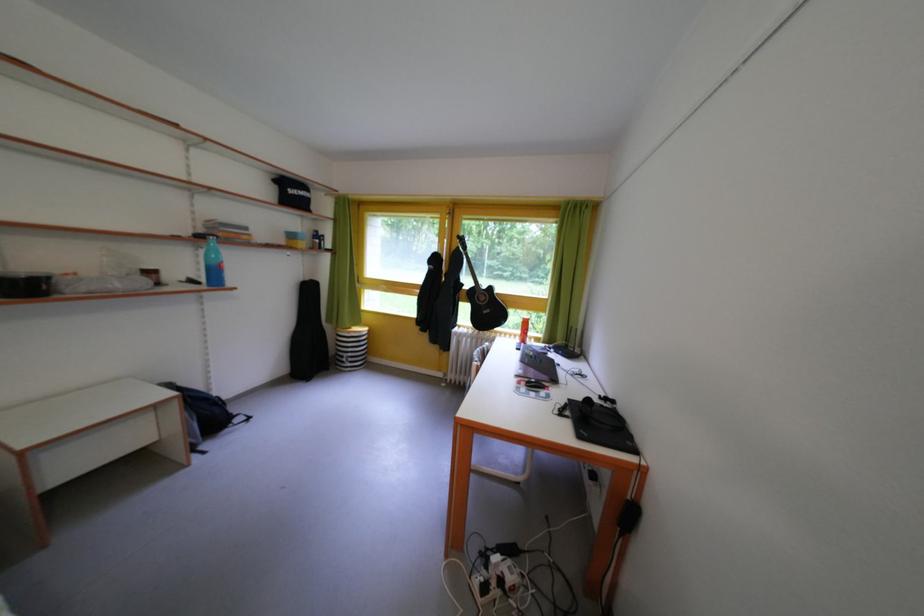
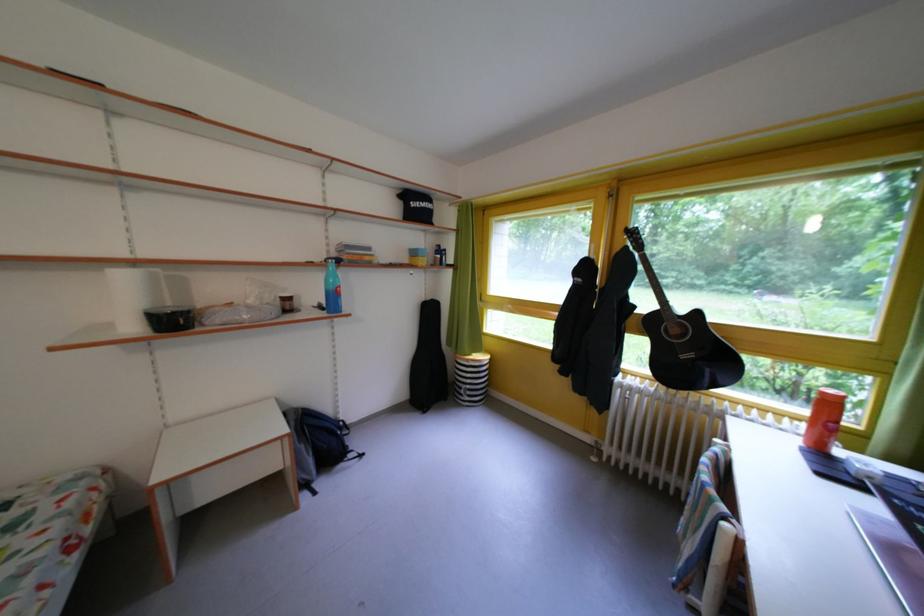
In the second image, find the point that corresponds to the point at 494,318 in the first image.

(693, 362)